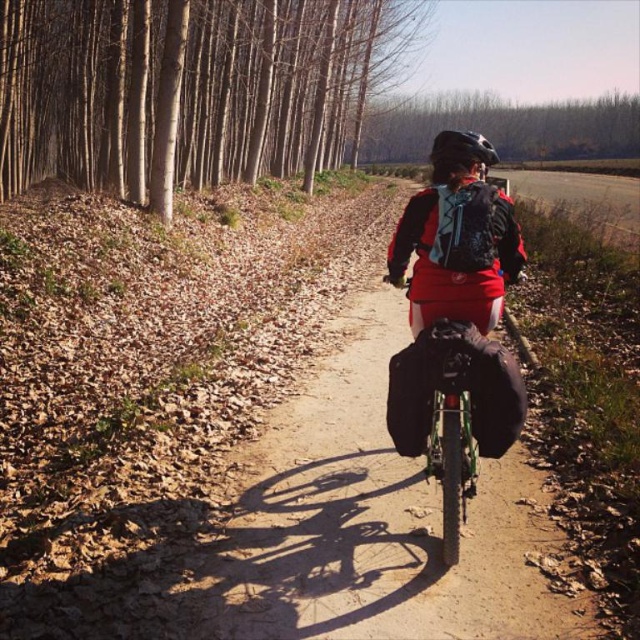
You are a photographer trying to capture the cyclist from behind. Which object, the matte black jacket at center or the matte black helmet at center, would appear larger in the photo?

The matte black helmet at center appears larger than the matte black jacket at center in the photo because the matte black jacket at center is smaller than the matte black helmet at center.

You are a photographer aiming to capture the cyclist from behind. You notice the matte black jacket at center and the matte black helmet at center. Which object appears taller in the photo?

The matte black helmet at center appears taller than the matte black jacket at center in the photo.